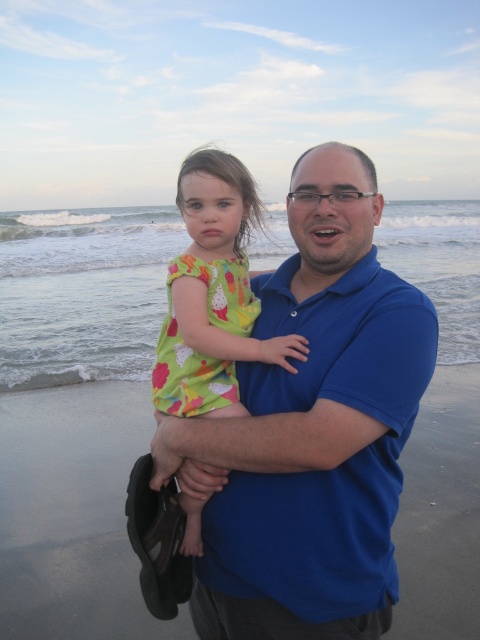
You are a photographer trying to capture the smooth sand at center and the printed cotton dress at center in the same frame. Which object should you focus on first to ensure both are in focus?

You should focus on the smooth sand at center first because it is closer to the viewer than the printed cotton dress at center, ensuring both will be in focus when using a proper depth of field.

You are standing on the beach and see two points marked in the image. Which point is nearer to you, point (247, 609) or point (259, 301)?

Point (247, 609) is closer to the viewer than point (259, 301).

Based on the scene description, can you determine whether the blue cotton shirt at center is touching the smooth sand at center?

The blue cotton shirt at center is above smooth sand at center, so they are not touching.